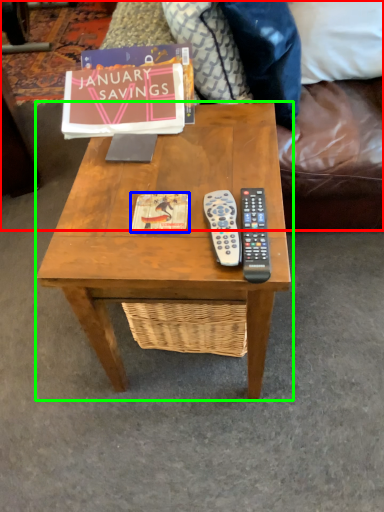
Question: Which object is the farthest from studio couch (highlighted by a red box)? Choose among these: book cover (highlighted by a blue box) or coffee table (highlighted by a green box).

Choices:
 (A) book cover
 (B) coffee table

Answer: (A)